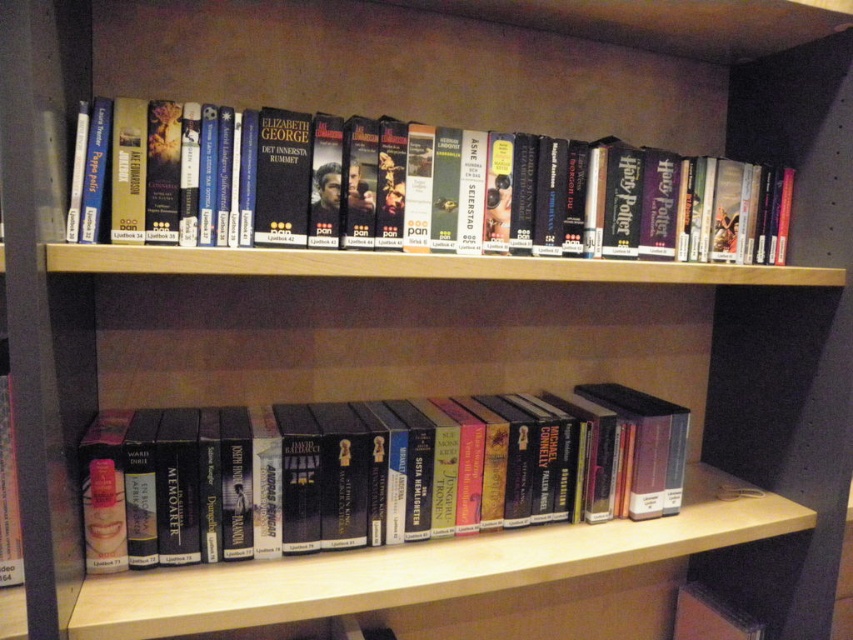
Question: Which of the following is the farthest from the observer?

Choices:
 (A) hardcover book at upper center
 (B) hardcover book at center

Answer: (B)

Question: Which of the following is the closest to the observer?

Choices:
 (A) hardcover book at upper center
 (B) hardcover book at center

Answer: (A)

Question: Where is hardcover book at center located in relation to hardcover book at upper center in the image?

Choices:
 (A) left
 (B) right

Answer: (A)

Question: Which of the following is the farthest from the observer?

Choices:
 (A) hardcover book at center
 (B) hardcover book at upper center

Answer: (A)

Question: Is hardcover book at center further to camera compared to hardcover book at upper center?

Choices:
 (A) yes
 (B) no

Answer: (A)

Question: Is hardcover book at center thinner than hardcover book at upper center?

Choices:
 (A) no
 (B) yes

Answer: (B)